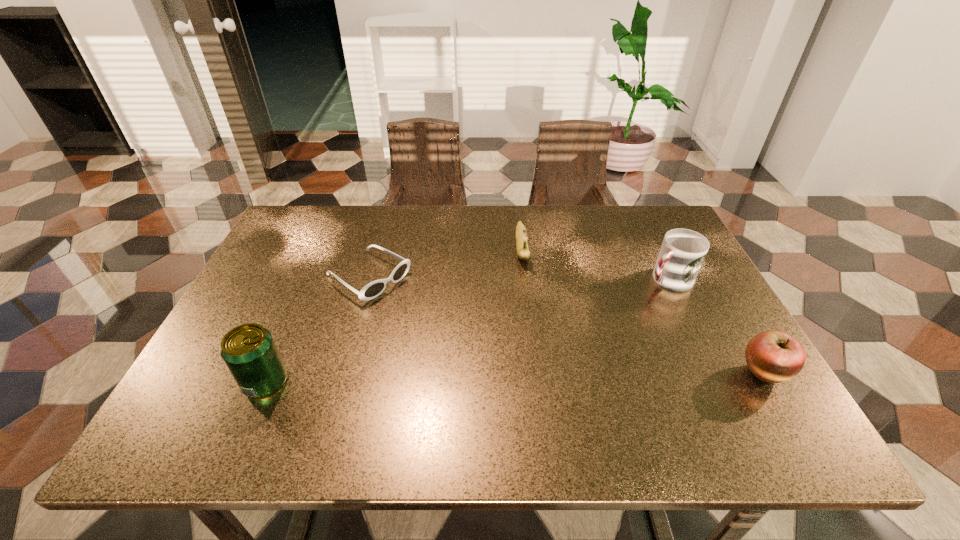
Image resolution: width=960 pixels, height=540 pixels. I want to click on free point between the banana and the shortest object, so click(x=445, y=262).

I want to click on vacant area that lies between the cup and the sunglasses, so click(518, 278).

Find the location of a particular element. The height and width of the screenshot is (540, 960). empty location between the sunglasses and the third object from right to left is located at coordinates (445, 262).

The height and width of the screenshot is (540, 960). I want to click on vacant area that lies between the third object from right to left and the apple, so click(642, 310).

Image resolution: width=960 pixels, height=540 pixels. Find the location of `vacant space that's between the apple and the banana`. vacant space that's between the apple and the banana is located at coordinates (642, 310).

Find the location of a particular element. This screenshot has height=540, width=960. blank region between the beer can and the third object from left to right is located at coordinates click(394, 315).

At what (x,y) coordinates should I click in order to perform the action: click on blank region between the sunglasses and the banana. Please return your answer as a coordinate pair (x, y). This screenshot has height=540, width=960. Looking at the image, I should click on (445, 262).

Find the location of a particular element. The width and height of the screenshot is (960, 540). free space between the beer can and the apple is located at coordinates (515, 378).

I want to click on empty space between the shortest object and the apple, so click(565, 325).

Image resolution: width=960 pixels, height=540 pixels. I want to click on free space between the cup and the shortest object, so click(518, 278).